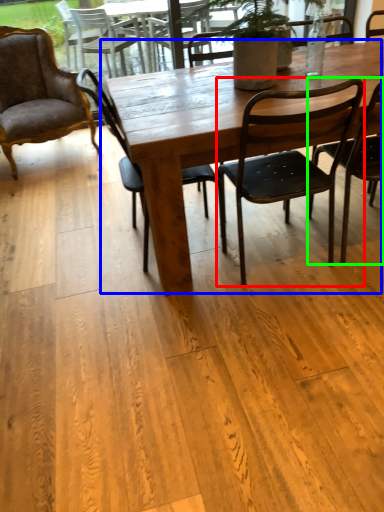
Question: Which object is the closest to the chair (highlighted by a red box)? Choose among these: kitchen & dining room table (highlighted by a blue box) or chair (highlighted by a green box).

Choices:
 (A) kitchen & dining room table
 (B) chair

Answer: (B)